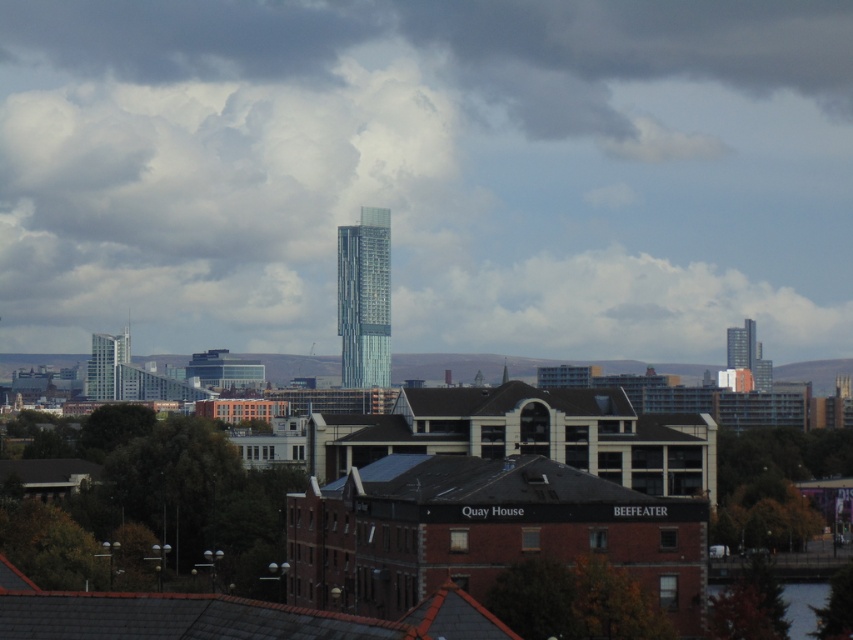
Question: Which object appears closest to the camera in this image?

Choices:
 (A) cloudy sky at center
 (B) glassy steel tower at upper right
 (C) glassy steel tower at left

Answer: (A)

Question: Which of the following is the farthest from the observer?

Choices:
 (A) glassy metallic skyscraper at center
 (B) cloudy sky at center
 (C) glassy steel tower at left
 (D) glassy steel tower at upper right

Answer: (C)

Question: Which object is the closest to the cloudy sky at center?

Choices:
 (A) glassy steel tower at left
 (B) glassy steel tower at upper right

Answer: (B)

Question: Considering the relative positions of cloudy sky at center and glassy steel tower at upper right in the image provided, where is cloudy sky at center located with respect to glassy steel tower at upper right?

Choices:
 (A) above
 (B) below

Answer: (A)

Question: Does glassy steel tower at left appear over glassy steel tower at upper right?

Choices:
 (A) yes
 (B) no

Answer: (B)

Question: Can you confirm if glassy steel tower at left is bigger than glassy steel tower at upper right?

Choices:
 (A) yes
 (B) no

Answer: (A)